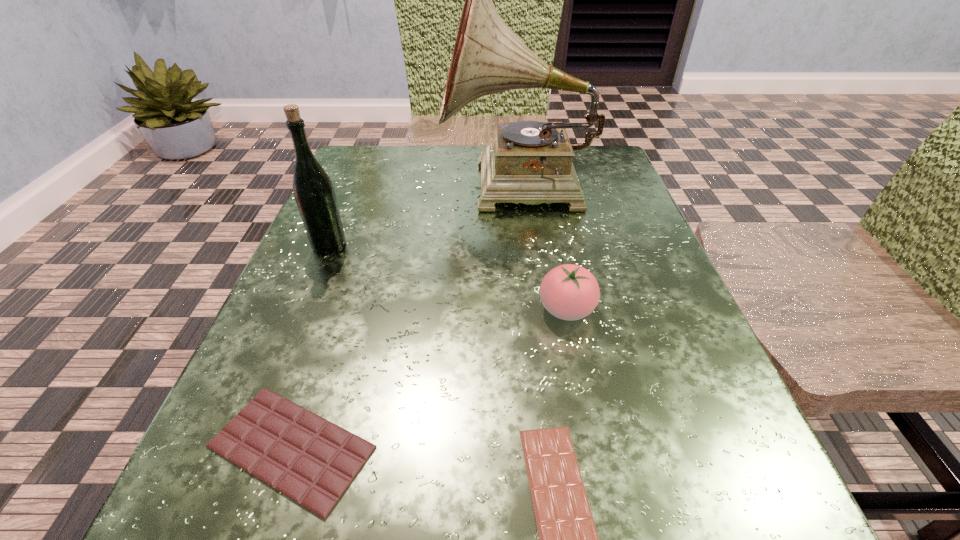
Where is `object located in the near left corner section of the desktop`? This screenshot has width=960, height=540. object located in the near left corner section of the desktop is located at coordinates (312, 461).

Locate an element on the screen. Image resolution: width=960 pixels, height=540 pixels. object positioned at the far right corner is located at coordinates (530, 162).

Locate an element on the screen. The width and height of the screenshot is (960, 540). free region at the far edge is located at coordinates (412, 183).

Identify the location of vacant space at the near edge of the desktop. The height and width of the screenshot is (540, 960). (348, 519).

The image size is (960, 540). Identify the location of vacant space at the left edge of the desktop. (257, 367).

The image size is (960, 540). Identify the location of free space at the right edge. (698, 341).

Find the location of a particular element. The image size is (960, 540). vacant position at the far left corner of the desktop is located at coordinates (376, 168).

The width and height of the screenshot is (960, 540). I want to click on free point at the far right corner, so click(611, 153).

Locate an element on the screen. Image resolution: width=960 pixels, height=540 pixels. unoccupied position between the third shortest object and the fourth nearest object is located at coordinates (448, 278).

Identify the location of free space between the taller chocolate bar and the second farthest object. The height and width of the screenshot is (540, 960). (310, 347).